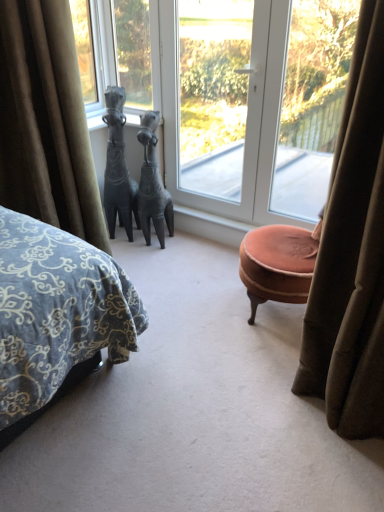
Question: From a real-world perspective, is transparent glass window at upper right, marked as the 1th window in a right-to-left arrangement, physically below velvet brown curtain at left?

Choices:
 (A) yes
 (B) no

Answer: (B)

Question: Is transparent glass window at upper right, marked as the 1th window in a right-to-left arrangement, positioned beyond the bounds of velvet brown curtain at left?

Choices:
 (A) no
 (B) yes

Answer: (B)

Question: From the image's perspective, would you say transparent glass window at upper right, marked as the 1th window in a right-to-left arrangement, is positioned over velvet brown curtain at left?

Choices:
 (A) no
 (B) yes

Answer: (B)

Question: Is transparent glass window at upper right, the 3th window positioned from the left, in contact with velvet brown curtain at left?

Choices:
 (A) no
 (B) yes

Answer: (A)

Question: Is transparent glass window at upper right, marked as the 1th window in a right-to-left arrangement, further to camera compared to velvet brown curtain at left?

Choices:
 (A) no
 (B) yes

Answer: (B)

Question: Can you confirm if transparent glass window at upper right, the 3th window positioned from the left, is positioned to the right of velvet brown curtain at left?

Choices:
 (A) no
 (B) yes

Answer: (B)

Question: Can transparent glass window at upper right, marked as the 1th window in a right-to-left arrangement, be found inside bronze horse at center?

Choices:
 (A) yes
 (B) no

Answer: (B)

Question: Can you confirm if bronze horse at center is positioned to the right of transparent glass window at upper right, the 3th window positioned from the left?

Choices:
 (A) no
 (B) yes

Answer: (A)

Question: Considering the relative sizes of bronze horse at center and transparent glass window at upper right, the 3th window positioned from the left, in the image provided, is bronze horse at center smaller than transparent glass window at upper right, the 3th window positioned from the left,?

Choices:
 (A) yes
 (B) no

Answer: (B)

Question: From the image's perspective, is bronze horse at center beneath transparent glass window at upper right, marked as the 1th window in a right-to-left arrangement?

Choices:
 (A) no
 (B) yes

Answer: (B)

Question: Can you confirm if bronze horse at center is shorter than transparent glass window at upper right, marked as the 1th window in a right-to-left arrangement?

Choices:
 (A) no
 (B) yes

Answer: (B)

Question: Is bronze horse at center not inside transparent glass window at upper right, the 3th window positioned from the left?

Choices:
 (A) yes
 (B) no

Answer: (A)

Question: Is transparent glass door at center, the second window positioned from the right, at the right side of velvet brown curtain at left?

Choices:
 (A) yes
 (B) no

Answer: (A)